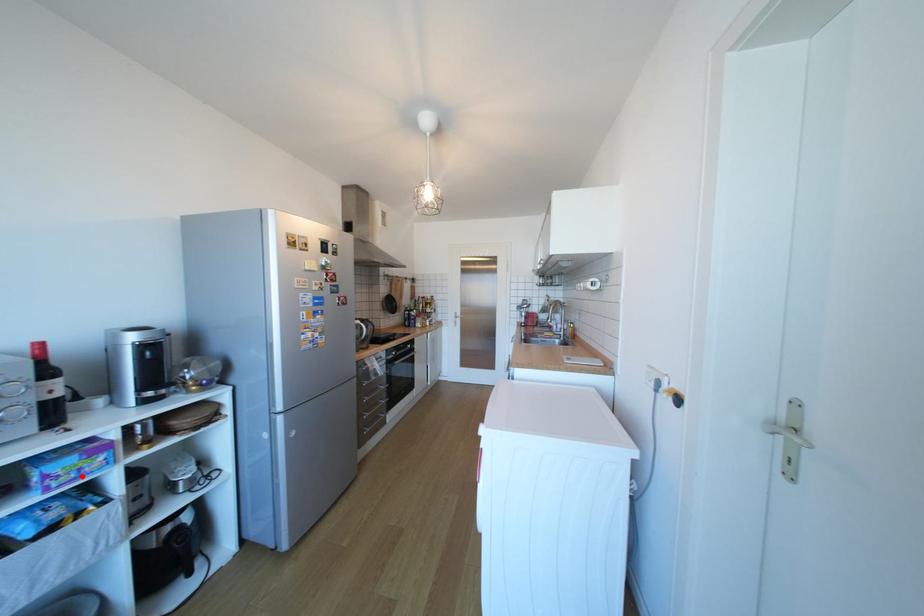
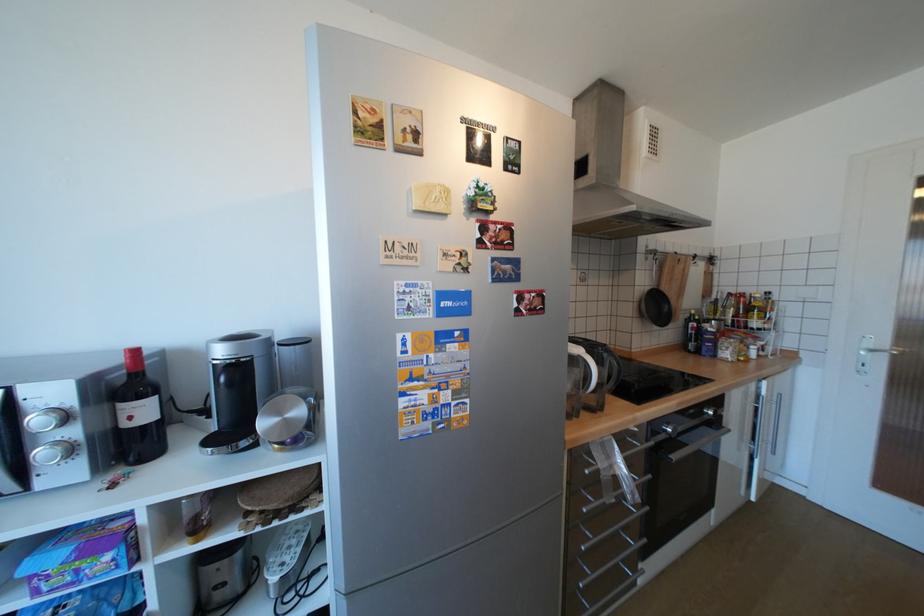
Question: I am providing you with two images of the same scene from different viewpoints. Image1 has a red point marked. In image2, the corresponding 3D location appears at what relative position? Reply with the corresponding letter.

Choices:
 (A) Closer
 (B) Farther

Answer: (A)